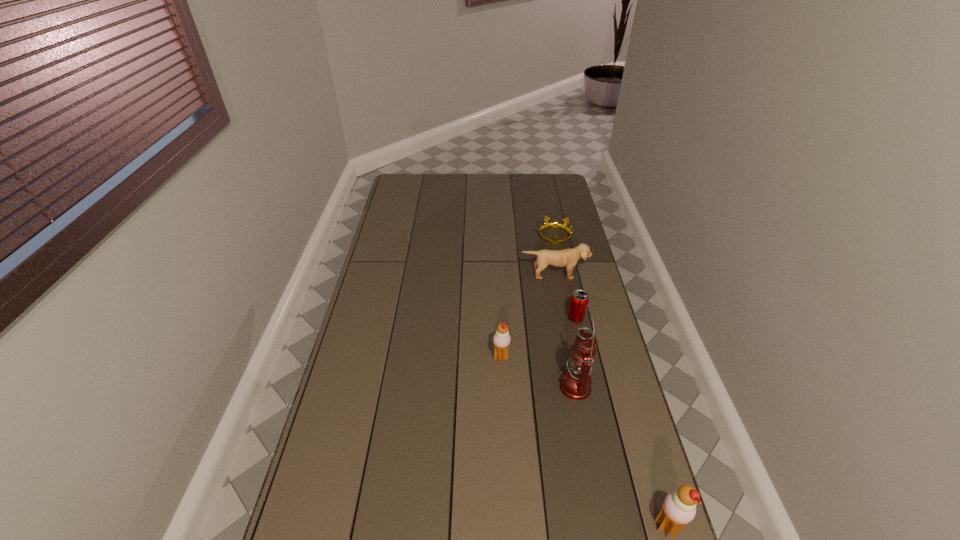
The height and width of the screenshot is (540, 960). What are the coordinates of `vacant region located at the front with a straw on the fourth farthest object` in the screenshot? It's located at (391, 357).

Identify the location of free space located 0.110m at the front with a straw on the fourth farthest object. (460, 357).

The width and height of the screenshot is (960, 540). Identify the location of free space located at the front with a straw on the fourth farthest object. (426, 357).

This screenshot has height=540, width=960. Find the location of `free space located 0.140m on the back of the crown`. free space located 0.140m on the back of the crown is located at coordinates (548, 210).

At what (x,y) coordinates should I click in order to perform the action: click on free space located 0.090m on the left side of the puppy. Please return your answer as a coordinate pair (x, y). Image resolution: width=960 pixels, height=540 pixels. Looking at the image, I should click on (559, 296).

Find the location of a particular element. free space located 0.280m on the left of the oil lamp is located at coordinates (470, 386).

At what (x,y) coordinates should I click in order to perform the action: click on vacant space situated on the left of the second shortest object. Please return your answer as a coordinate pair (x, y). Looking at the image, I should click on (x=480, y=318).

At what (x,y) coordinates should I click in order to perform the action: click on crown located at the right edge. Please return your answer as a coordinate pair (x, y). Looking at the image, I should click on (555, 224).

Locate an element on the screen. The image size is (960, 540). puppy at the right edge is located at coordinates (568, 258).

Where is `oil lamp located at the right edge`? This screenshot has width=960, height=540. oil lamp located at the right edge is located at coordinates (575, 384).